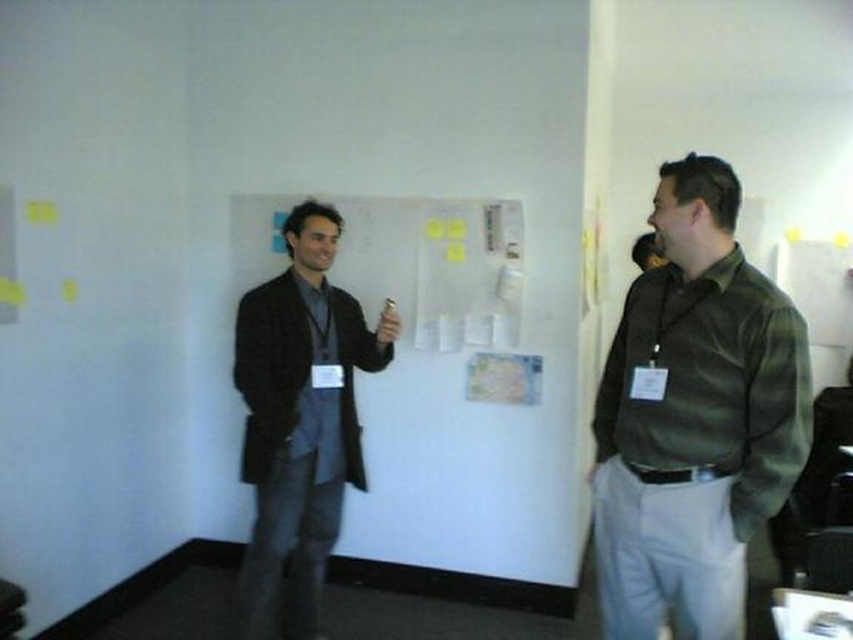
Question: Is white matte board at center bigger than dark gray wool jacket at left?

Choices:
 (A) no
 (B) yes

Answer: (B)

Question: Is white matte board at center smaller than dark gray wool jacket at left?

Choices:
 (A) no
 (B) yes

Answer: (A)

Question: Does white matte board at center lie behind camouflage shirt at right?

Choices:
 (A) yes
 (B) no

Answer: (A)

Question: Which point is farther to the camera?

Choices:
 (A) (308, 282)
 (B) (607, 602)

Answer: (A)

Question: Among these points, which one is farthest from the camera?

Choices:
 (A) (537, 416)
 (B) (323, 330)

Answer: (A)

Question: Estimate the real-world distances between objects in this image. Which object is closer to the dark gray wool jacket at left?

Choices:
 (A) white matte board at center
 (B) camouflage shirt at right

Answer: (A)